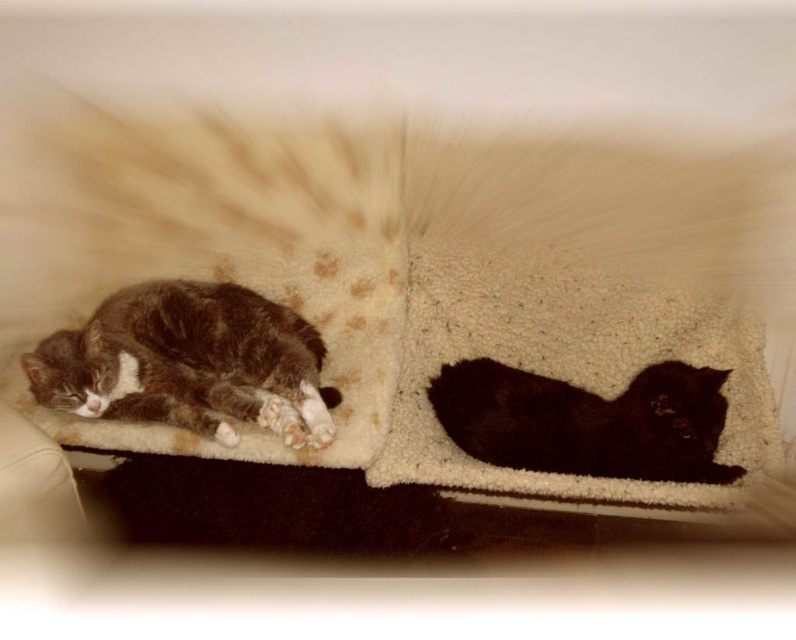
You are a cat owner who wants to place a small toy between the gray fur cat at left and the shiny black cat at center. Since the cats are close, you need to ensure the toy won

The gray fur cat at left is larger in size than the shiny black cat at center, so the toy should be placed closer to the smaller shiny black cat at center to avoid disturbing the larger gray fur cat at left.

You are a cat owner who wants to place a small toy between the gray fur cat at left and the shiny black cat at center. What is the minimum distance the toy should be placed from each cat to ensure it is exactly between them?

The minimum distance the toy should be placed from each cat is half of 23.51 inches, which is approximately 11.75 inches.